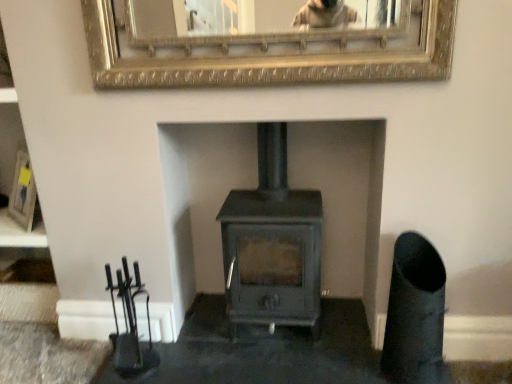
Find the location of `free spot to the right of matte gray wood burning stove at center`. free spot to the right of matte gray wood burning stove at center is located at coordinates (344, 329).